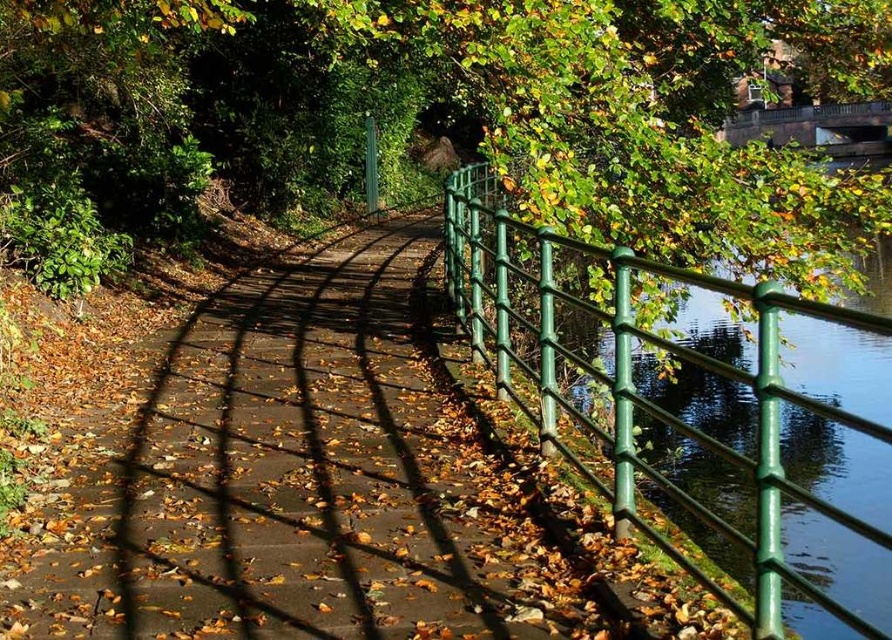
Question: Is green metal fence at right bigger than dark gray stone bridge at upper right?

Choices:
 (A) yes
 (B) no

Answer: (A)

Question: Observing the image, what is the correct spatial positioning of green metal fence at right in reference to dark gray stone bridge at upper right?

Choices:
 (A) right
 (B) left

Answer: (B)

Question: Which object is farther from the camera taking this photo?

Choices:
 (A) green metal fence at right
 (B) dark gray stone bridge at upper right

Answer: (B)

Question: Which point appears farthest from the camera in this image?

Choices:
 (A) (475, 195)
 (B) (797, 141)

Answer: (B)

Question: Does green metal fence at right have a lesser width compared to dark gray stone bridge at upper right?

Choices:
 (A) no
 (B) yes

Answer: (A)